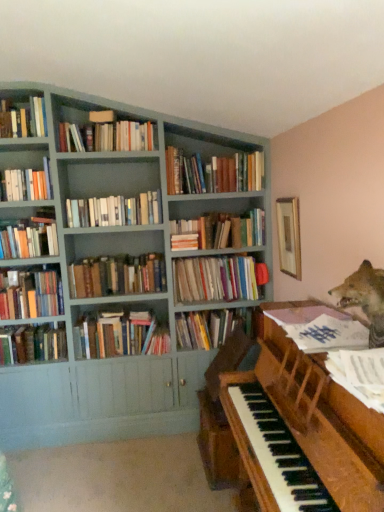
Find the location of a particular element. The width and height of the screenshot is (384, 512). blank space situated above white paper at piano, which appears as the 4th book when ordered from the bottom (from a real-world perspective) is located at coordinates (363, 357).